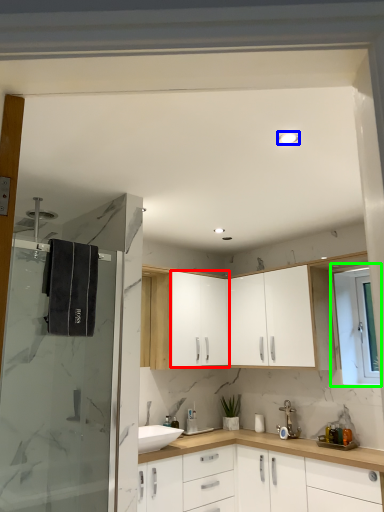
Question: Which is nearer to the cabinetry (highlighted by a red box)? light fixture (highlighted by a blue box) or window (highlighted by a green box).

Choices:
 (A) light fixture
 (B) window

Answer: (B)